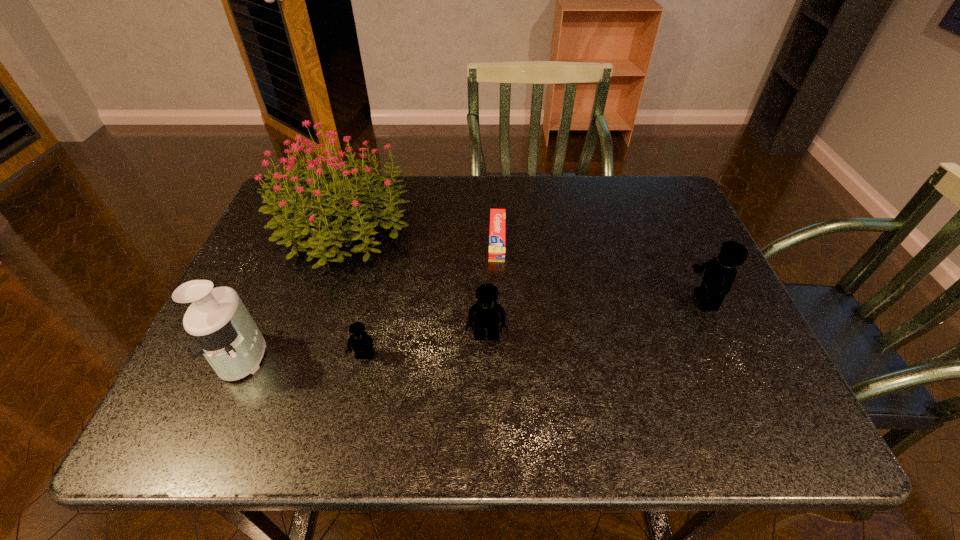
Locate an element on the screen. The width and height of the screenshot is (960, 540). empty space that is in between the nearest Lego and the tallest object is located at coordinates (353, 292).

You are a GUI agent. You are given a task and a screenshot of the screen. Output one action in this format:
    pyautogui.click(x=<x>, y=<y>)
    Task: Click on the vacant area that lies between the third shortest object and the tallest object
    The image size is (960, 540).
    Given the screenshot: What is the action you would take?
    pyautogui.click(x=414, y=282)

What are the coordinates of `object that is the closest to the fourth nearest object` in the screenshot? It's located at (497, 216).

Choose which object is the fourth nearest neighbor to the leftmost Lego. Please provide its 2D coordinates. Your answer should be formatted as a tuple, i.e. [(x, y)], where the tuple contains the x and y coordinates of a point satisfying the conditions above.

[(497, 216)]

The height and width of the screenshot is (540, 960). What are the coordinates of `the second closest Lego to the shortest object` in the screenshot? It's located at (362, 344).

Identify which Lego is located as the second nearest to the second nearest Lego. Please provide its 2D coordinates. Your answer should be formatted as a tuple, i.e. [(x, y)], where the tuple contains the x and y coordinates of a point satisfying the conditions above.

[(720, 272)]